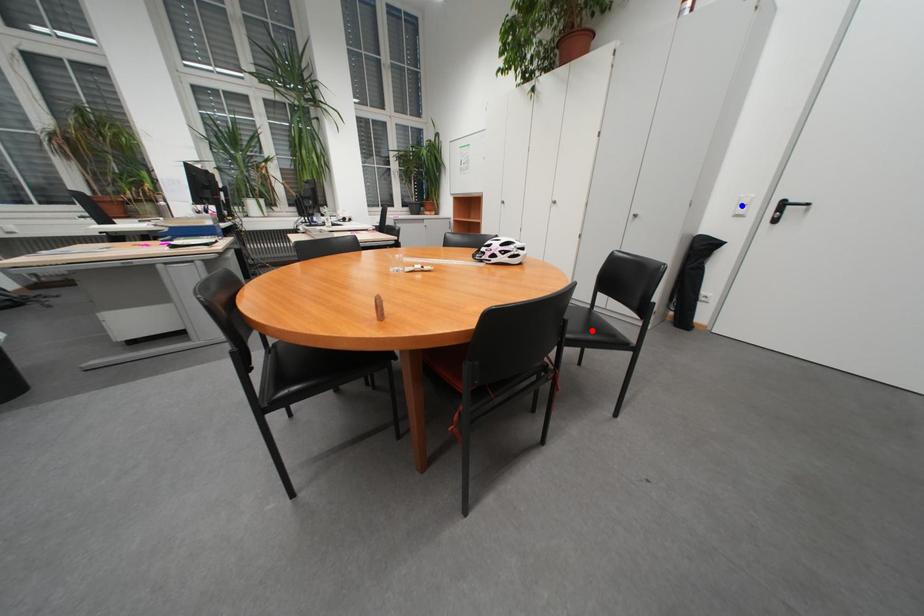
Question: Two points are marked on the image. Which point is closer to the camera?

Choices:
 (A) Blue point is closer.
 (B) Red point is closer.

Answer: (B)